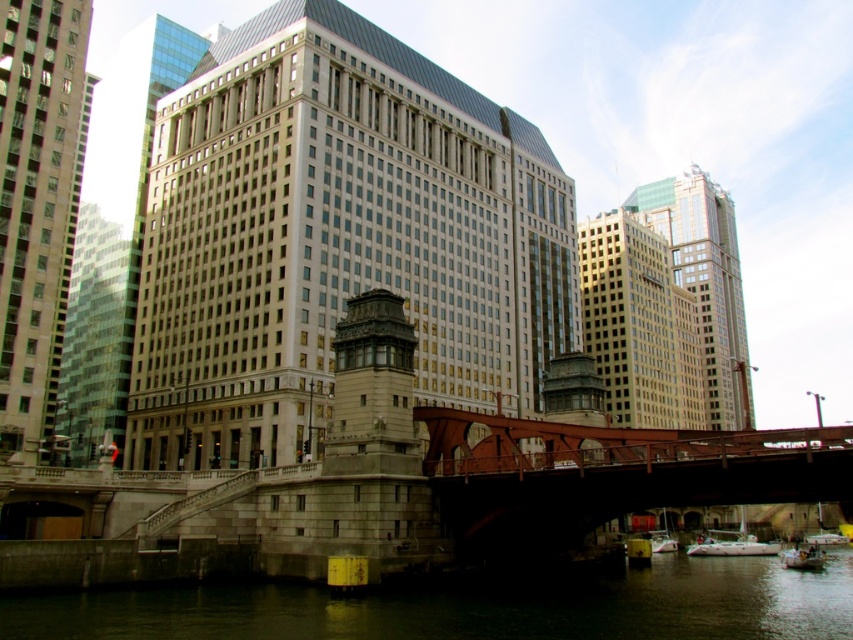
You are an urban planner analyzing the layout of this city. You notice the beige stone tower at center. Can you determine its exact coordinates in the image?

The beige stone tower at center is located at coordinates point (335,237).

You are a city planner assessing the urban layout. You need to determine if the beige stone tower at center and the white plastic boat at lower right can both fit within a 10 meter wide pathway that runs horizontally through the image. Can both objects fit side by side without overlapping?

The beige stone tower at center might be wider than white plastic boat at lower right, so it is uncertain if both can fit within the 10 meter pathway. Further measurements are needed to confirm.